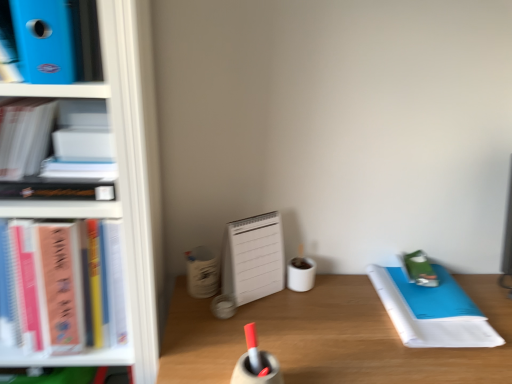
Find the location of a particular element. Image resolution: width=512 pixels, height=384 pixels. free point in front of green matte notebook at right is located at coordinates (442, 340).